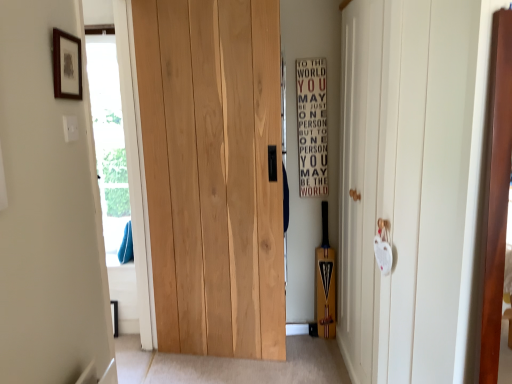
I want to click on white matte door at right, the second door in the left-to-right sequence, so click(407, 187).

Find the location of `white matte door at right, the second door in the left-to-right sequence`. white matte door at right, the second door in the left-to-right sequence is located at coordinates (407, 187).

Is white matte door at right, the second door in the left-to-right sequence, to the left of natural wood door at center, the second door from the right, from the viewer's perspective?

Incorrect, white matte door at right, the second door in the left-to-right sequence, is not on the left side of natural wood door at center, the second door from the right.

From the image's perspective, is white matte door at right, the second door in the left-to-right sequence, below natural wood door at center, the second door from the right?

Yes, from the image's perspective, white matte door at right, the second door in the left-to-right sequence, is below natural wood door at center, the second door from the right.

Is point (389, 120) less distant than point (225, 85)?

Yes, point (389, 120) is closer to viewer.

Considering the relative positions of transparent glass door at left and natural wood door at center, which is the first door in left-to-right order, in the image provided, is transparent glass door at left to the right of natural wood door at center, which is the first door in left-to-right order, from the viewer's perspective?

Incorrect, transparent glass door at left is not on the right side of natural wood door at center, which is the first door in left-to-right order.

Is transparent glass door at left smaller than natural wood door at center, the second door from the right?

Incorrect, transparent glass door at left is not smaller in size than natural wood door at center, the second door from the right.

Can you tell me how much transparent glass door at left and natural wood door at center, which is the first door in left-to-right order, differ in facing direction?

They differ by 98.8 degrees in their facing directions.

In the image, is transparent glass door at left positioned in front of or behind natural wood door at center, the second door from the right?

Clearly, transparent glass door at left is in front of natural wood door at center, the second door from the right.

From a real-world perspective, is transparent glass door at left physically below white matte door at right, the second door in the left-to-right sequence?

Actually, transparent glass door at left is physically above white matte door at right, the second door in the left-to-right sequence, in the real world.

Between transparent glass door at left and white matte door at right, the second door in the left-to-right sequence, which one has larger size?

white matte door at right, the second door in the left-to-right sequence.

Is transparent glass door at left far away from white matte door at right, the first door when ordered from right to left?

Yes.

From the image's perspective, is transparent glass door at left located above or below white matte door at right, the first door when ordered from right to left?

Based on their image positions, transparent glass door at left is located above white matte door at right, the first door when ordered from right to left.

Considering the sizes of objects wooden sign at center right and natural wood door at center, the second door from the right, in the image provided, who is bigger, wooden sign at center right or natural wood door at center, the second door from the right,?

With larger size is natural wood door at center, the second door from the right.

What's the angular difference between wooden sign at center right and natural wood door at center, which is the first door in left-to-right order,'s facing directions?

The angular difference between wooden sign at center right and natural wood door at center, which is the first door in left-to-right order, is 8.83 degrees.

Is wooden sign at center right closer to the viewer compared to natural wood door at center, which is the first door in left-to-right order?

No, it is not.

From the image's perspective, which one is positioned higher, wooden sign at center right or natural wood door at center, which is the first door in left-to-right order?

wooden sign at center right is shown above in the image.

Could you tell me if wooden framed print at upper left is turned towards white matte door at right, the second door in the left-to-right sequence?

Yes, wooden framed print at upper left faces towards white matte door at right, the second door in the left-to-right sequence.

Is wooden framed print at upper left positioned beyond the bounds of white matte door at right, the first door when ordered from right to left?

wooden framed print at upper left is positioned outside white matte door at right, the first door when ordered from right to left.

From a real-world perspective, is wooden framed print at upper left positioned above or below white matte door at right, the first door when ordered from right to left?

In terms of real-world spatial position, wooden framed print at upper left is above white matte door at right, the first door when ordered from right to left.

How different are the orientations of white matte door at right, the first door when ordered from right to left, and wooden sign at center right in degrees?

→ 89.5 degrees.

Is white matte door at right, the first door when ordered from right to left, far away from wooden sign at center right?

No.

Is white matte door at right, the first door when ordered from right to left, taller than wooden sign at center right?

Indeed, white matte door at right, the first door when ordered from right to left, has a greater height compared to wooden sign at center right.

From the image's perspective, who appears lower, white matte door at right, the first door when ordered from right to left, or wooden sign at center right?

white matte door at right, the first door when ordered from right to left.

Is natural wood door at center, which is the first door in left-to-right order, far from wooden sign at center right?

Actually, natural wood door at center, which is the first door in left-to-right order, and wooden sign at center right are a little close together.

From a real-world perspective, who is located lower, natural wood door at center, which is the first door in left-to-right order, or wooden sign at center right?

From a 3D spatial view, natural wood door at center, which is the first door in left-to-right order, is below.

From the image's perspective, is natural wood door at center, the second door from the right, located above or below wooden sign at center right?

Clearly, from the image's perspective, natural wood door at center, the second door from the right, is below wooden sign at center right.

Image resolution: width=512 pixels, height=384 pixels. What are the coordinates of `door located behind the white matte door at right, the second door in the left-to-right sequence` in the screenshot? It's located at (213, 173).

I want to click on glass door located above the natural wood door at center, the second door from the right (from a real-world perspective), so click(x=118, y=165).

From the image, which object appears to be nearer to white matte door at right, the second door in the left-to-right sequence, wooden framed print at upper left or natural wood door at center, the second door from the right?

natural wood door at center, the second door from the right.

Looking at the image, which one is located closer to transparent glass door at left, wooden sign at center right or wooden framed print at upper left?

Based on the image, wooden sign at center right appears to be nearer to transparent glass door at left.

Looking at the image, which one is located further to white matte door at right, the second door in the left-to-right sequence, wooden sign at center right or natural wood door at center, the second door from the right?

Based on the image, wooden sign at center right appears to be further to white matte door at right, the second door in the left-to-right sequence.

From the image, which object appears to be farther from transparent glass door at left, wooden framed print at upper left or natural wood door at center, the second door from the right?

Based on the image, wooden framed print at upper left appears to be further to transparent glass door at left.

From the image, which object appears to be nearer to wooden framed print at upper left, white matte door at right, the first door when ordered from right to left, or wooden sign at center right?

white matte door at right, the first door when ordered from right to left, is positioned closer to the anchor wooden framed print at upper left.

Looking at this image, based on their spatial positions, is white matte door at right, the first door when ordered from right to left, or wooden framed print at upper left closer to natural wood door at center, the second door from the right?

white matte door at right, the first door when ordered from right to left, lies closer to natural wood door at center, the second door from the right, than the other object.

When comparing their distances from wooden sign at center right, does natural wood door at center, the second door from the right, or white matte door at right, the first door when ordered from right to left, seem further?

Based on the image, white matte door at right, the first door when ordered from right to left, appears to be further to wooden sign at center right.

When comparing their distances from white matte door at right, the first door when ordered from right to left, does wooden framed print at upper left or transparent glass door at left seem further?

transparent glass door at left lies further to white matte door at right, the first door when ordered from right to left, than the other object.

Where is `door between transparent glass door at left and wooden sign at center right in the front-back direction`? door between transparent glass door at left and wooden sign at center right in the front-back direction is located at coordinates (213, 173).

Identify the location of picture frame between white matte door at right, the second door in the left-to-right sequence, and wooden sign at center right in the front-back direction. The image size is (512, 384). (67, 65).

The width and height of the screenshot is (512, 384). I want to click on door between white matte door at right, the first door when ordered from right to left, and wooden sign at center right in the front-back direction, so click(x=213, y=173).

Where is `glass door positioned between white matte door at right, the first door when ordered from right to left, and wooden sign at center right from near to far`? This screenshot has width=512, height=384. glass door positioned between white matte door at right, the first door when ordered from right to left, and wooden sign at center right from near to far is located at coordinates (118, 165).